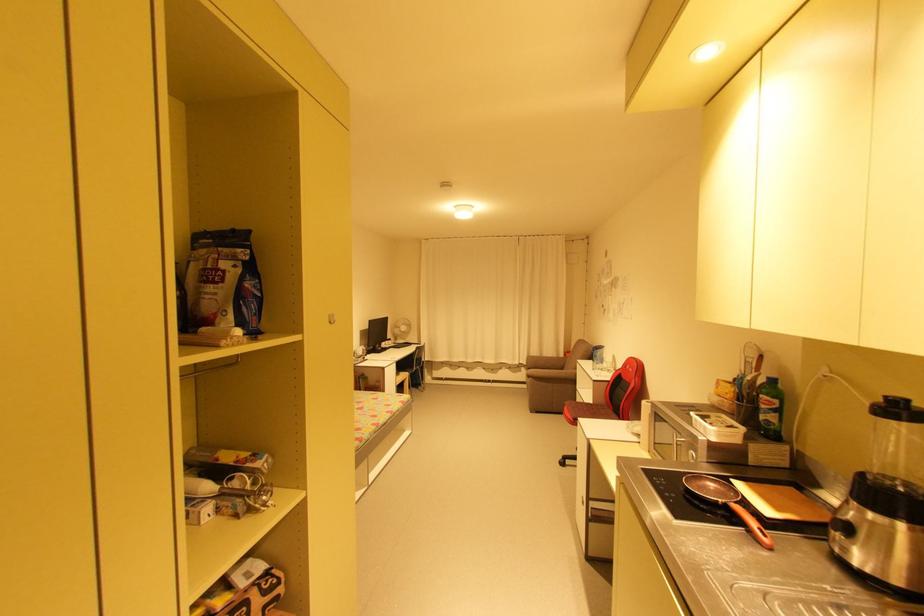
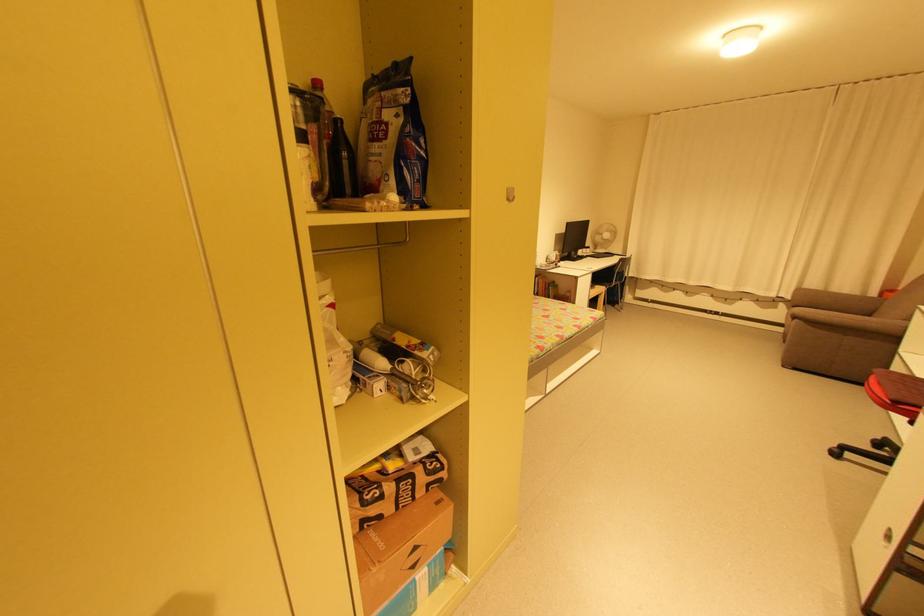
The point at (536,411) is marked in the first image. Where is the corresponding point in the second image?

(788, 367)